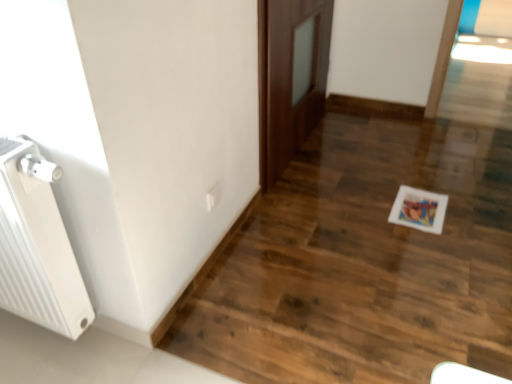
Question: Is white plastic electric outlet at lower center taller than brown wooden door at center?

Choices:
 (A) no
 (B) yes

Answer: (A)

Question: Are white plastic electric outlet at lower center and brown wooden door at center located far from each other?

Choices:
 (A) yes
 (B) no

Answer: (B)

Question: Is the position of white plastic electric outlet at lower center less distant than that of brown wooden door at center?

Choices:
 (A) no
 (B) yes

Answer: (B)

Question: Does white plastic electric outlet at lower center have a greater width compared to brown wooden door at center?

Choices:
 (A) yes
 (B) no

Answer: (B)

Question: Is the depth of white plastic electric outlet at lower center greater than that of brown wooden door at center?

Choices:
 (A) no
 (B) yes

Answer: (A)

Question: From a real-world perspective, is white ribbed radiator at left above or below white plastic electric outlet at lower center?

Choices:
 (A) below
 (B) above

Answer: (B)

Question: In terms of width, does white ribbed radiator at left look wider or thinner when compared to white plastic electric outlet at lower center?

Choices:
 (A) wide
 (B) thin

Answer: (A)

Question: Based on their positions, is white ribbed radiator at left located to the left or right of white plastic electric outlet at lower center?

Choices:
 (A) right
 (B) left

Answer: (B)

Question: In terms of size, does white ribbed radiator at left appear bigger or smaller than white plastic electric outlet at lower center?

Choices:
 (A) small
 (B) big

Answer: (B)

Question: Considering the positions of white ribbed radiator at left and brown wooden door at center in the image, is white ribbed radiator at left taller or shorter than brown wooden door at center?

Choices:
 (A) tall
 (B) short

Answer: (B)

Question: Is white ribbed radiator at left to the left or to the right of brown wooden door at center in the image?

Choices:
 (A) left
 (B) right

Answer: (A)

Question: In terms of size, does white ribbed radiator at left appear bigger or smaller than brown wooden door at center?

Choices:
 (A) small
 (B) big

Answer: (A)

Question: Is white ribbed radiator at left inside or outside of brown wooden door at center?

Choices:
 (A) inside
 (B) outside

Answer: (B)

Question: From their relative heights in the image, would you say brown wooden door at center is taller or shorter than white plastic electric outlet at lower center?

Choices:
 (A) tall
 (B) short

Answer: (A)

Question: Looking at their shapes, would you say brown wooden door at center is wider or thinner than white plastic electric outlet at lower center?

Choices:
 (A) thin
 (B) wide

Answer: (B)